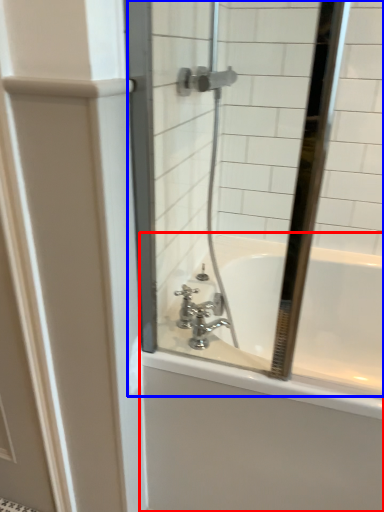
Question: Which object is closer to the camera taking this photo, bathtub (highlighted by a red box) or mirror (highlighted by a blue box)?

Choices:
 (A) bathtub
 (B) mirror

Answer: (B)